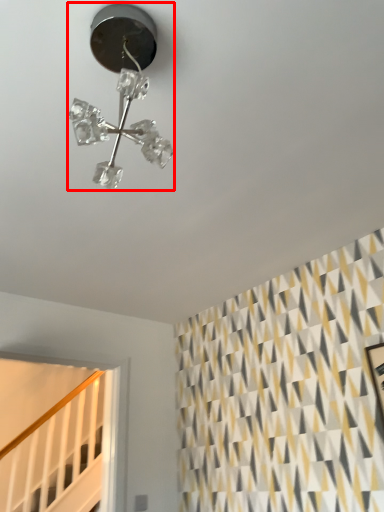
Question: In this image, where is lamp (annotated by the red box) located relative to stairwell?

Choices:
 (A) right
 (B) left

Answer: (A)